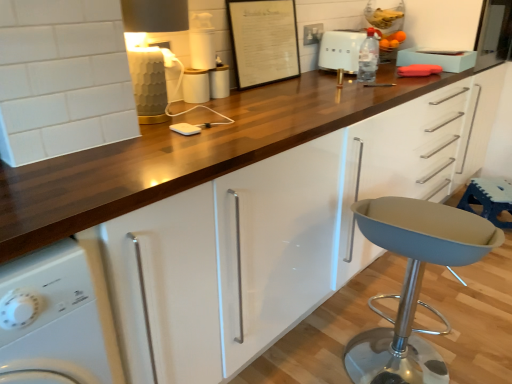
Question: From the image's perspective, is blue fabric bar stool at lower right positioned above or below white glossy washing machine at lower left?

Choices:
 (A) above
 (B) below

Answer: (A)

Question: Is blue fabric bar stool at lower right inside or outside of white glossy washing machine at lower left?

Choices:
 (A) inside
 (B) outside

Answer: (B)

Question: Which is nearer to the metallic silver canister at center, acting as the second appliance starting from the top?

Choices:
 (A) white plastic container at upper center, the 1th appliance in the top-to-bottom sequence
 (B) white paper at upper center
 (C) blue fabric bar stool at lower right
 (D) matte gray stool at lower right
 (E) white glossy washing machine at lower left

Answer: (A)

Question: Which of these objects is positioned farthest from the white matte charger at center, the 1th appliance positioned from the bottom?

Choices:
 (A) white plastic toaster at upper center
 (B) transparent plastic bottle at upper center
 (C) blue fabric bar stool at lower right
 (D) metallic silver canister at center, acting as the second appliance starting from the top
 (E) white glossy cup at center, the 3th appliance when ordered from top to bottom

Answer: (C)